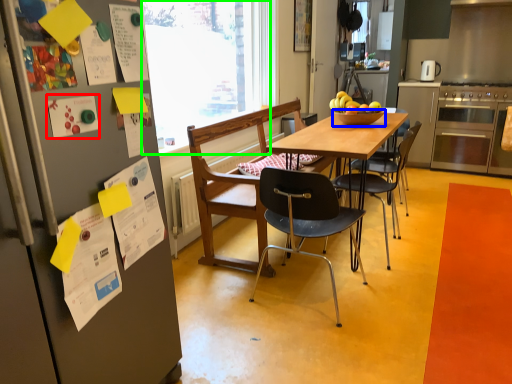
Question: Which object is the closest to the poster (highlighted by a red box)? Choose among these: bowl (highlighted by a blue box) or window screen (highlighted by a green box).

Choices:
 (A) bowl
 (B) window screen

Answer: (A)